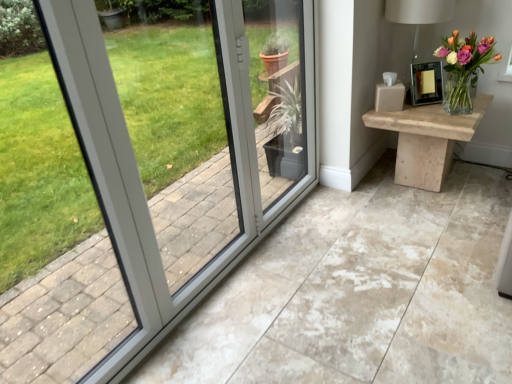
At what (x,y) coordinates should I click in order to perform the action: click on free location to the left of natural wood table at right. Please return your answer as a coordinate pair (x, y). The height and width of the screenshot is (384, 512). Looking at the image, I should click on (343, 210).